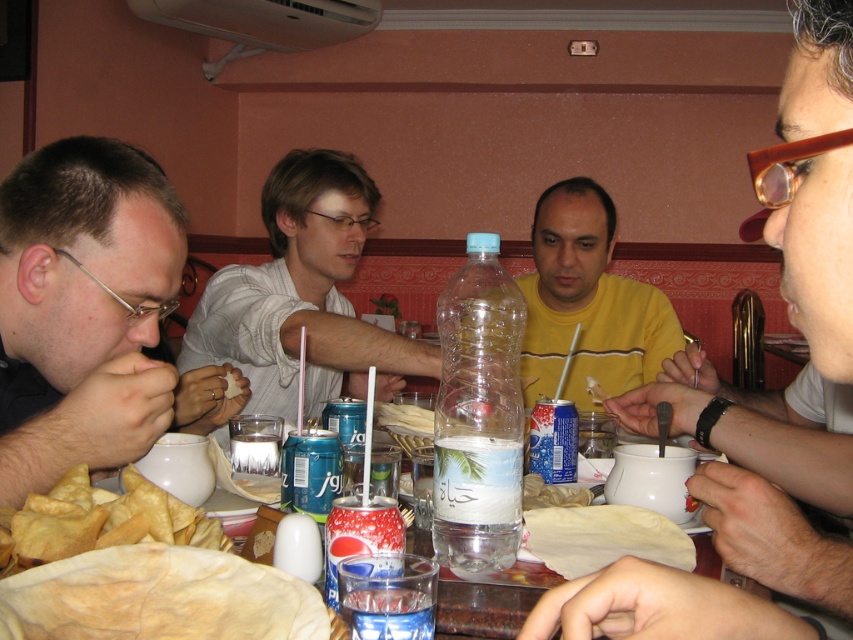
Looking at this image, you are a waiter in a restaurant and need to place a new drink order for the customer. The customer wants their drink placed exactly 20 inches away from them. Given that the translucent plastic cup at lower center is already on the table, can you place the new drink order at the required distance?

The translucent plastic cup at lower center is currently 19.38 inches away from the viewer, so placing the new drink order at exactly 20 inches away would be possible as it is slightly further than the existing cup.